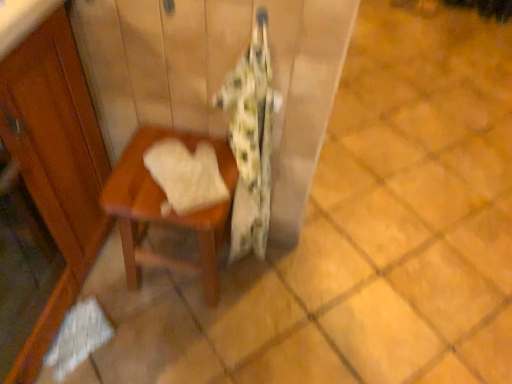
Question: Looking at their shapes, would you say white soft towel at center is wider or thinner than wooden table at center?

Choices:
 (A) wide
 (B) thin

Answer: (B)

Question: Considering their positions, is white soft towel at center located in front of or behind wooden table at center?

Choices:
 (A) behind
 (B) front

Answer: (B)

Question: Estimate the real-world distances between objects in this image. Which object is farther from the white soft towel at center?

Choices:
 (A) wooden table at center
 (B) fluffy white blanket at center

Answer: (B)

Question: Which of these objects is positioned closest to the wooden table at center?

Choices:
 (A) white soft towel at center
 (B) fluffy white blanket at center

Answer: (A)